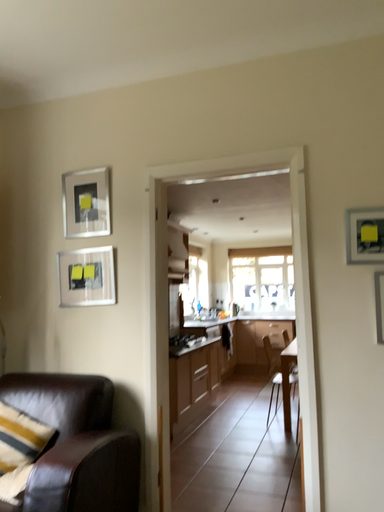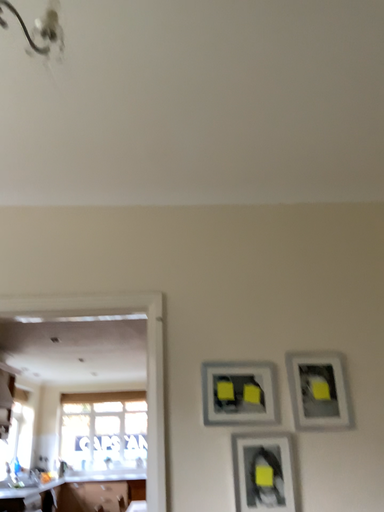
Question: How did the camera likely rotate when shooting the video?

Choices:
 (A) rotated upward
 (B) rotated downward

Answer: (A)